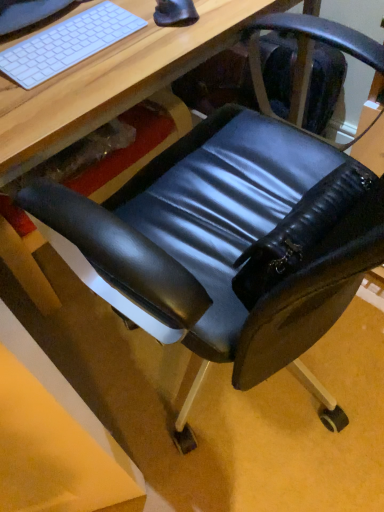
I want to click on free spot to the right of black rubber mouse at upper center, so click(225, 14).